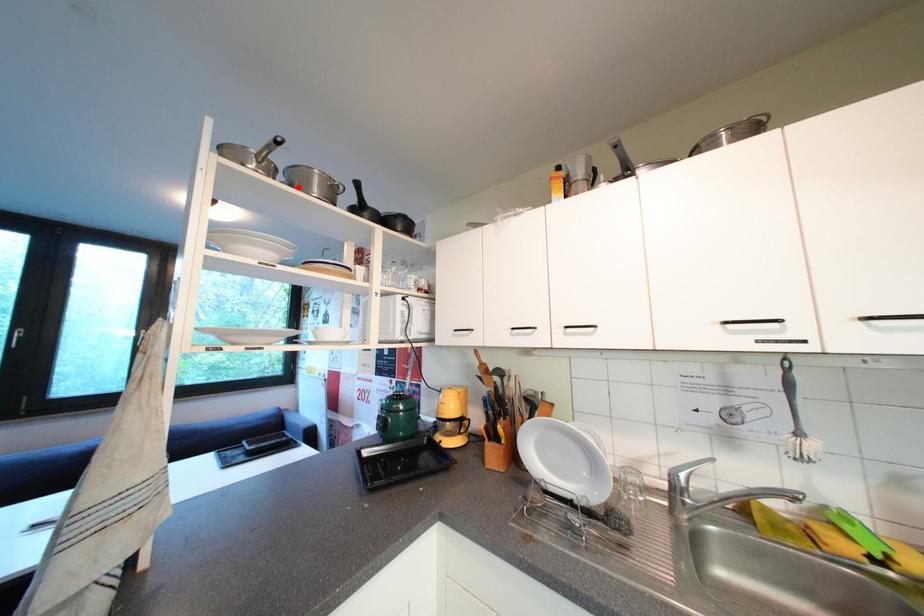
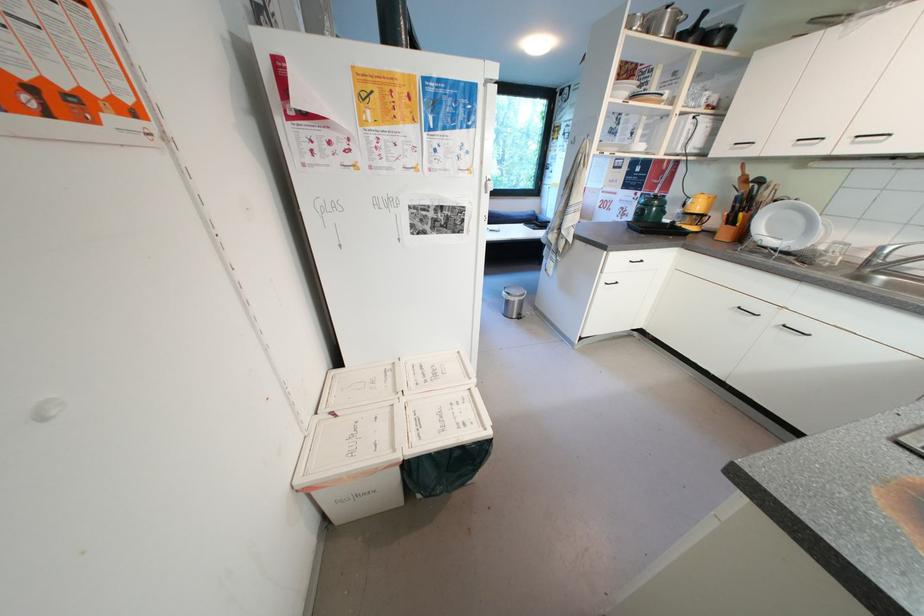
The point at the highlighted location is marked in the first image. Where is the corresponding point in the second image?

(657, 33)